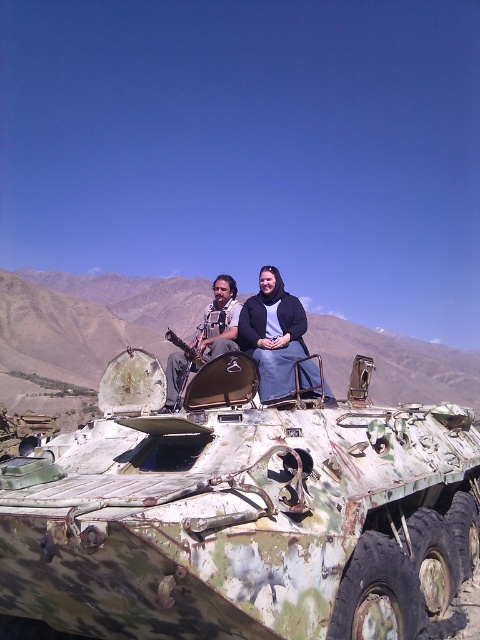
Between matte black jacket at center and matte black rifle at upper center, which one appears on the left side from the viewer's perspective?

matte black rifle at upper center

Which is more to the right, matte black jacket at center or matte black rifle at upper center?

matte black jacket at center

Between point (263, 282) and point (232, 317), which one is positioned behind?

Point (232, 317)

The width and height of the screenshot is (480, 640). Identify the location of matte black jacket at center. (273, 333).

Is point (431, 470) positioned in front of point (245, 301)?

Yes, point (431, 470) is closer to viewer.

Is camouflage paint tank at center to the right of matte black jacket at center from the viewer's perspective?

In fact, camouflage paint tank at center is to the left of matte black jacket at center.

Where is `camouflage paint tank at center`? camouflage paint tank at center is located at coordinates (240, 512).

Is camouflage paint tank at center smaller than matte black rifle at upper center?

Yes, camouflage paint tank at center is smaller than matte black rifle at upper center.

Is point (360, 589) positioned in front of point (226, 323)?

Yes.

Who is more forward, (373,433) or (194,349)?

Point (373,433)

Where is `camouflage paint tank at center`? camouflage paint tank at center is located at coordinates (240, 512).